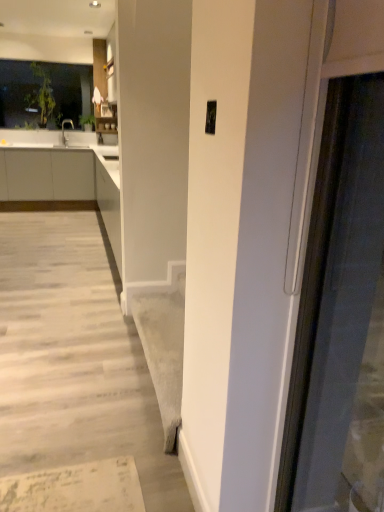
I want to click on matte silver faucet at upper left, so click(64, 130).

Image resolution: width=384 pixels, height=512 pixels. I want to click on white matte cabinetry at left, so click(x=46, y=175).

Considering the relative positions of matte silver faucet at upper left and white matte cabinetry at left in the image provided, is matte silver faucet at upper left to the left or to the right of white matte cabinetry at left?

In the image, matte silver faucet at upper left appears on the right side of white matte cabinetry at left.

Measure the distance between matte silver faucet at upper left and white matte cabinetry at left.

matte silver faucet at upper left is 1.10 meters away from white matte cabinetry at left.

Is white matte cabinetry at left inside matte silver faucet at upper left?

No, white matte cabinetry at left is not inside matte silver faucet at upper left.

Is matte silver faucet at upper left further to the viewer compared to white matte cabinetry at left?

Yes, it is.

Is matte silver faucet at upper left at the back of transparent glass window at upper left?

No, transparent glass window at upper left is not facing the opposite direction of matte silver faucet at upper left.

Is transparent glass window at upper left outside of matte silver faucet at upper left?

Yes, transparent glass window at upper left is not within matte silver faucet at upper left.

Where is `window on the left side of matte silver faucet at upper left`? The height and width of the screenshot is (512, 384). window on the left side of matte silver faucet at upper left is located at coordinates (43, 93).

Which object is positioned more to the right, transparent glass window at upper left or matte silver faucet at upper left?

matte silver faucet at upper left is more to the right.

At what (x,y) coordinates should I click in order to perform the action: click on cabinetry that appears below the matte silver faucet at upper left (from a real-world perspective). Please return your answer as a coordinate pair (x, y). Image resolution: width=384 pixels, height=512 pixels. Looking at the image, I should click on 46,175.

Considering the sizes of white matte cabinetry at left and matte silver faucet at upper left in the image, is white matte cabinetry at left taller or shorter than matte silver faucet at upper left?

Clearly, white matte cabinetry at left is taller compared to matte silver faucet at upper left.

How distant is white matte cabinetry at left from matte silver faucet at upper left?

white matte cabinetry at left is 3.62 feet away from matte silver faucet at upper left.

In the image, is transparent glass window at upper left positioned in front of or behind white matte cabinetry at left?

Visually, transparent glass window at upper left is located behind white matte cabinetry at left.

Is point (44, 77) more distant than point (43, 158)?

Yes, it is.

Is transparent glass window at upper left beside white matte cabinetry at left?

transparent glass window at upper left and white matte cabinetry at left are clearly separated.

Does transparent glass window at upper left have a larger size compared to white matte cabinetry at left?

Actually, transparent glass window at upper left might be smaller than white matte cabinetry at left.

From a real-world perspective, is white matte cabinetry at left over transparent glass window at upper left?

No.

Between white matte cabinetry at left and transparent glass window at upper left, which one has more height?

With more height is transparent glass window at upper left.

In the image, is white matte cabinetry at left positioned in front of or behind transparent glass window at upper left?

In the image, white matte cabinetry at left appears in front of transparent glass window at upper left.

In the scene shown: Is white matte cabinetry at left not inside transparent glass window at upper left?

Indeed, white matte cabinetry at left is completely outside transparent glass window at upper left.

Where is `window in front of the matte silver faucet at upper left`? window in front of the matte silver faucet at upper left is located at coordinates click(43, 93).

Is there a large distance between matte silver faucet at upper left and transparent glass window at upper left?

matte silver faucet at upper left is actually quite close to transparent glass window at upper left.

Considering the sizes of objects matte silver faucet at upper left and transparent glass window at upper left in the image provided, who is shorter, matte silver faucet at upper left or transparent glass window at upper left?

With less height is matte silver faucet at upper left.

Image resolution: width=384 pixels, height=512 pixels. There is a white matte cabinetry at left. Identify the location of tap above it (from a real-world perspective). (64, 130).

Where is `window above the matte silver faucet at upper left (from the image's perspective)`? This screenshot has width=384, height=512. window above the matte silver faucet at upper left (from the image's perspective) is located at coordinates (43, 93).

Based on their spatial positions, is transparent glass window at upper left or matte silver faucet at upper left further from white matte cabinetry at left?

Among the two, transparent glass window at upper left is located further to white matte cabinetry at left.

Looking at the image, which one is located further to transparent glass window at upper left, white matte cabinetry at left or matte silver faucet at upper left?

white matte cabinetry at left is further to transparent glass window at upper left.

Estimate the real-world distances between objects in this image. Which object is closer to matte silver faucet at upper left, white matte cabinetry at left or transparent glass window at upper left?

Based on the image, transparent glass window at upper left appears to be nearer to matte silver faucet at upper left.

Consider the image. Estimate the real-world distances between objects in this image. Which object is closer to transparent glass window at upper left, matte silver faucet at upper left or white matte cabinetry at left?

Among the two, matte silver faucet at upper left is located nearer to transparent glass window at upper left.

Which object lies nearer to the anchor point white matte cabinetry at left, matte silver faucet at upper left or transparent glass window at upper left?

The object closer to white matte cabinetry at left is matte silver faucet at upper left.

From the image, which object appears to be nearer to matte silver faucet at upper left, transparent glass window at upper left or white matte cabinetry at left?

transparent glass window at upper left lies closer to matte silver faucet at upper left than the other object.

This screenshot has width=384, height=512. I want to click on tap between transparent glass window at upper left and white matte cabinetry at left in the up-down direction, so click(64, 130).